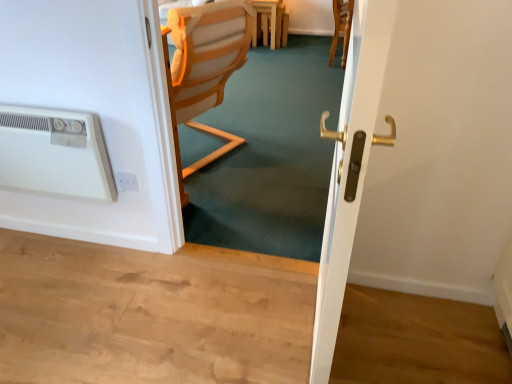
Question: Does white plastic air conditioning unit at left have a larger size compared to wooden chair at center?

Choices:
 (A) yes
 (B) no

Answer: (B)

Question: Would you say white plastic air conditioning unit at left contains wooden chair at center?

Choices:
 (A) no
 (B) yes

Answer: (A)

Question: Is white plastic air conditioning unit at left taller than wooden chair at center?

Choices:
 (A) yes
 (B) no

Answer: (B)

Question: Is white plastic air conditioning unit at left thinner than wooden chair at center?

Choices:
 (A) yes
 (B) no

Answer: (A)

Question: Considering the relative positions of white plastic air conditioning unit at left and wooden chair at center in the image provided, is white plastic air conditioning unit at left behind wooden chair at center?

Choices:
 (A) no
 (B) yes

Answer: (A)

Question: Would you say light brown wooden table at center is inside or outside white plastic air conditioning unit at left?

Choices:
 (A) outside
 (B) inside

Answer: (A)

Question: In terms of height, does light brown wooden table at center look taller or shorter compared to white plastic air conditioning unit at left?

Choices:
 (A) tall
 (B) short

Answer: (A)

Question: Considering the positions of point coord(285,21) and point coord(6,105), is point coord(285,21) closer or farther from the camera than point coord(6,105)?

Choices:
 (A) closer
 (B) farther

Answer: (B)

Question: In terms of size, does light brown wooden table at center appear bigger or smaller than white plastic air conditioning unit at left?

Choices:
 (A) big
 (B) small

Answer: (B)

Question: From a real-world perspective, is white plastic electric outlet at lower left above or below white glossy door handle at center?

Choices:
 (A) above
 (B) below

Answer: (B)

Question: Is white plastic electric outlet at lower left in front of or behind white glossy door handle at center in the image?

Choices:
 (A) behind
 (B) front

Answer: (A)

Question: Which is correct: white plastic electric outlet at lower left is inside white glossy door handle at center, or outside of it?

Choices:
 (A) outside
 (B) inside

Answer: (A)

Question: Is white plastic electric outlet at lower left to the left or to the right of white glossy door handle at center in the image?

Choices:
 (A) left
 (B) right

Answer: (A)

Question: Considering the positions of white plastic air conditioning unit at left and wooden chair at center in the image, is white plastic air conditioning unit at left bigger or smaller than wooden chair at center?

Choices:
 (A) small
 (B) big

Answer: (A)

Question: In the image, is white plastic air conditioning unit at left on the left side or the right side of wooden chair at center?

Choices:
 (A) left
 (B) right

Answer: (A)